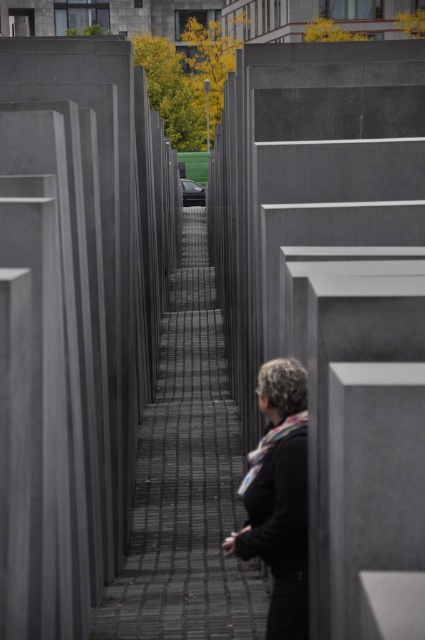
Question: Can you confirm if gray concrete at center is positioned to the right of black matte jacket at center?

Choices:
 (A) no
 (B) yes

Answer: (A)

Question: Is gray concrete at center positioned at the back of black matte jacket at center?

Choices:
 (A) no
 (B) yes

Answer: (B)

Question: Which point is closer to the camera?

Choices:
 (A) black matte jacket at center
 (B) gray concrete at center

Answer: (A)

Question: Is gray concrete at center above black matte jacket at center?

Choices:
 (A) no
 (B) yes

Answer: (A)

Question: Which object appears closest to the camera in this image?

Choices:
 (A) black matte jacket at center
 (B) gray concrete at center

Answer: (A)